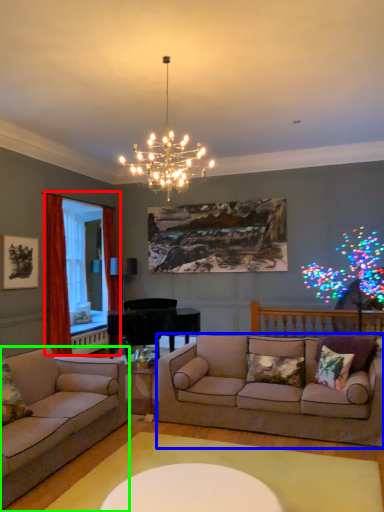
Question: Which object is the closest to the window screen (highlighted by a red box)? Choose among these: studio couch (highlighted by a blue box) or studio couch (highlighted by a green box).

Choices:
 (A) studio couch
 (B) studio couch

Answer: (B)